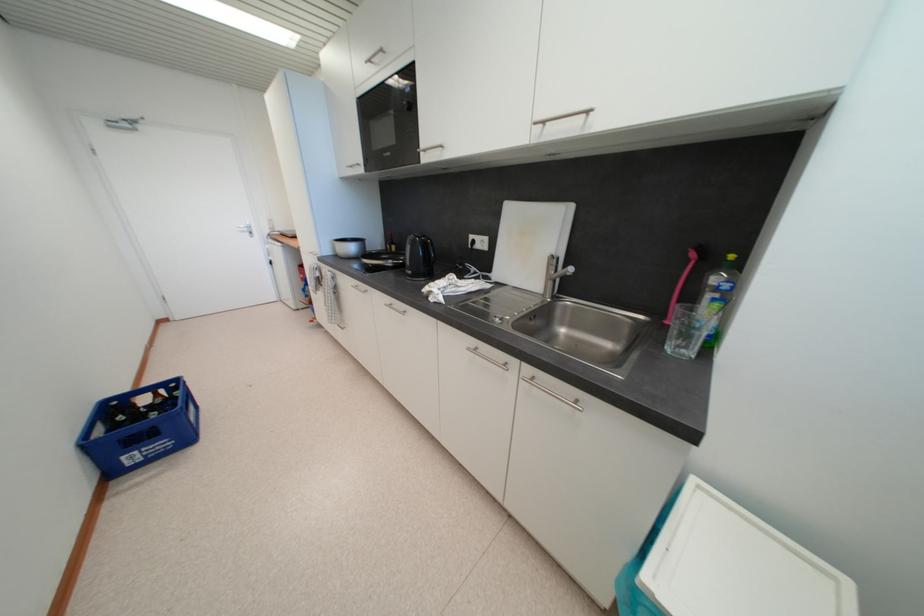
The image size is (924, 616). In order to click on sink faucet handle in this screenshot , I will do pos(561,273).